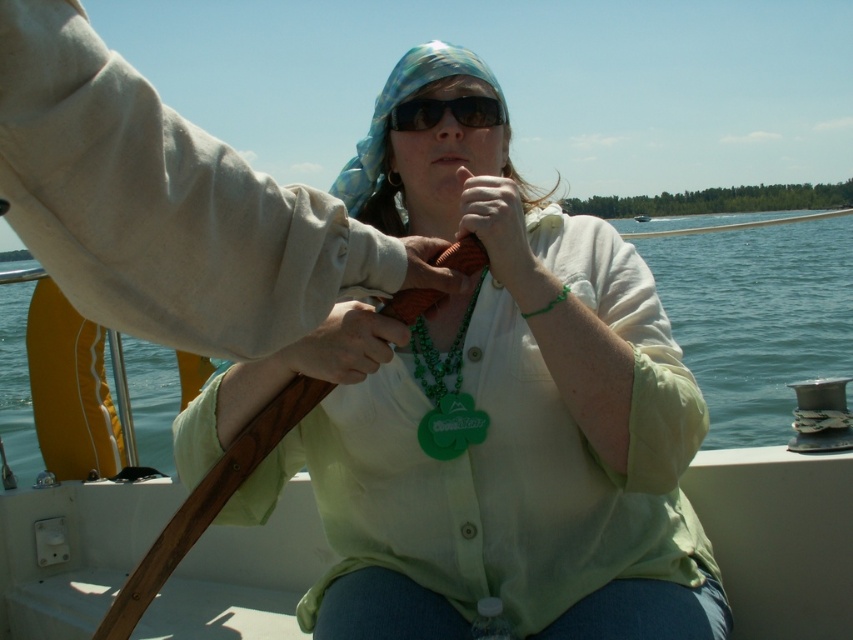
Is matte green shirt at center in front of matte brown object at center?

Yes.

Between point (331, 518) and point (532, 259), which one is positioned behind?

The point (331, 518) is behind.

Who is more distant from viewer, (712, 582) or (462, 198)?

The point (712, 582) is more distant.

You are a GUI agent. You are given a task and a screenshot of the screen. Output one action in this format:
    pyautogui.click(x=<x>, y=<y>)
    Task: Click on the matte green shirt at center
    This screenshot has height=640, width=853.
    Given the screenshot: What is the action you would take?
    pyautogui.click(x=502, y=422)

Can you confirm if matte green shirt at center is positioned below matte green necklace at center?

Correct, matte green shirt at center is located below matte green necklace at center.

What do you see at coordinates (502, 422) in the screenshot?
I see `matte green shirt at center` at bounding box center [502, 422].

Find the location of a particular element. matte green shirt at center is located at coordinates (502, 422).

Is clear blue water at center to the left of orange rubber band at center from the viewer's perspective?

No, clear blue water at center is not to the left of orange rubber band at center.

Can you confirm if clear blue water at center is positioned to the right of orange rubber band at center?

Indeed, clear blue water at center is positioned on the right side of orange rubber band at center.

Who is more forward, (x=732, y=326) or (x=421, y=244)?

Point (x=421, y=244) is in front.

What are the coordinates of `clear blue water at center` in the screenshot? It's located at (757, 317).